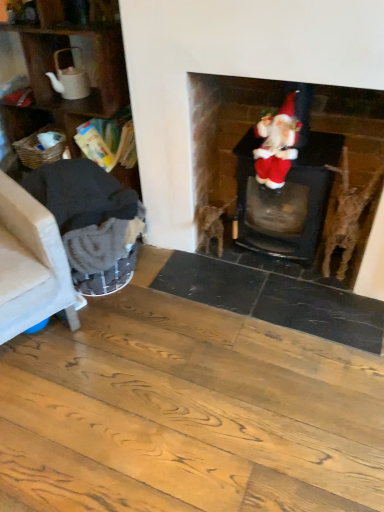
Question: Would you say beige fabric armchair at left, acting as the first armchair starting from the left, is part of dark gray fabric armchair at left, which is the first armchair from right to left,'s contents?

Choices:
 (A) yes
 (B) no

Answer: (B)

Question: From the image's perspective, is dark gray fabric armchair at left, which is the first armchair from right to left, beneath beige fabric armchair at left, placed as the 2th armchair when sorted from right to left?

Choices:
 (A) no
 (B) yes

Answer: (A)

Question: Does dark gray fabric armchair at left, marked as the second armchair in a left-to-right arrangement, lie behind beige fabric armchair at left, acting as the first armchair starting from the left?

Choices:
 (A) no
 (B) yes

Answer: (B)

Question: Does dark gray fabric armchair at left, marked as the second armchair in a left-to-right arrangement, appear on the right side of beige fabric armchair at left, placed as the 2th armchair when sorted from right to left?

Choices:
 (A) no
 (B) yes

Answer: (B)

Question: Is dark gray fabric armchair at left, marked as the second armchair in a left-to-right arrangement, not close to beige fabric armchair at left, placed as the 2th armchair when sorted from right to left?

Choices:
 (A) no
 (B) yes

Answer: (A)

Question: From the image's perspective, relative to velvet santa at center, is beige fabric armchair at left, placed as the 2th armchair when sorted from right to left, above or below?

Choices:
 (A) above
 (B) below

Answer: (B)

Question: Is beige fabric armchair at left, placed as the 2th armchair when sorted from right to left, in front of or behind velvet santa at center in the image?

Choices:
 (A) behind
 (B) front

Answer: (B)

Question: From a real-world perspective, is beige fabric armchair at left, placed as the 2th armchair when sorted from right to left, physically located above or below velvet santa at center?

Choices:
 (A) above
 (B) below

Answer: (B)

Question: Is point (49, 228) closer or farther from the camera than point (284, 164)?

Choices:
 (A) closer
 (B) farther

Answer: (A)

Question: In terms of size, does velvet santa at center appear bigger or smaller than velvet santa at upper right?

Choices:
 (A) big
 (B) small

Answer: (B)

Question: Looking at their shapes, would you say velvet santa at center is wider or thinner than velvet santa at upper right?

Choices:
 (A) wide
 (B) thin

Answer: (B)

Question: From the image's perspective, is velvet santa at center located above or below velvet santa at upper right?

Choices:
 (A) above
 (B) below

Answer: (A)

Question: Is velvet santa at center inside or outside of velvet santa at upper right?

Choices:
 (A) inside
 (B) outside

Answer: (A)

Question: From the image's perspective, relative to velvet santa at center, is dark gray fabric armchair at left, marked as the second armchair in a left-to-right arrangement, above or below?

Choices:
 (A) below
 (B) above

Answer: (A)

Question: In terms of size, does dark gray fabric armchair at left, marked as the second armchair in a left-to-right arrangement, appear bigger or smaller than velvet santa at center?

Choices:
 (A) big
 (B) small

Answer: (A)